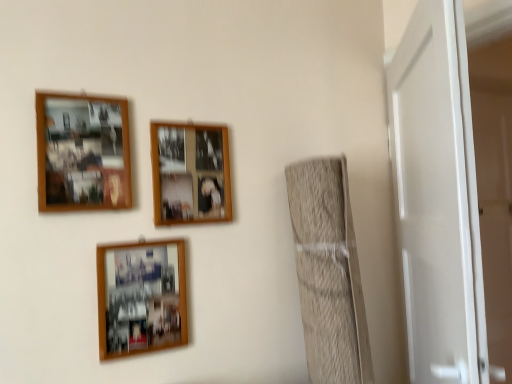
Image resolution: width=512 pixels, height=384 pixels. What do you see at coordinates (437, 198) in the screenshot? I see `white glossy door at right` at bounding box center [437, 198].

Where is `wooden photo frame at upper left, positioned as the 3th picture frame in bottom-to-top order`? wooden photo frame at upper left, positioned as the 3th picture frame in bottom-to-top order is located at coordinates (82, 153).

Measure the distance between point (146, 316) and camera.

Point (146, 316) is 1.24 meters away from camera.

Find the location of a particular element. The image size is (512, 384). woodenobject at upper center, the 2th picture frame in the bottom-to-top sequence is located at coordinates (190, 173).

How different are the orientations of woodenobject at upper center, the 2th picture frame in the bottom-to-top sequence, and white glossy door at right in degrees?

The angular difference between woodenobject at upper center, the 2th picture frame in the bottom-to-top sequence, and white glossy door at right is 52.9 degrees.

Which is behind, point (159, 194) or point (472, 219)?

The point (159, 194) is farther.

Is woodenobject at upper center, arranged as the 2th picture frame when viewed from the top, thinner than white glossy door at right?

Correct, the width of woodenobject at upper center, arranged as the 2th picture frame when viewed from the top, is less than that of white glossy door at right.

Considering the positions of objects woodenobject at upper center, arranged as the 2th picture frame when viewed from the top, and white glossy door at right in the image provided, who is in front, woodenobject at upper center, arranged as the 2th picture frame when viewed from the top, or white glossy door at right?

white glossy door at right is more forward.

Does wooden photo frame at lower center, which appears as the first picture frame when ordered from the bottom, contain wooden photo frame at upper left, acting as the 1th picture frame starting from the top?

No.

Does wooden photo frame at lower center, which appears as the first picture frame when ordered from the bottom, have a greater height compared to wooden photo frame at upper left, acting as the 1th picture frame starting from the top?

Incorrect, the height of wooden photo frame at lower center, which appears as the first picture frame when ordered from the bottom, is not larger of that of wooden photo frame at upper left, acting as the 1th picture frame starting from the top.

Is point (102, 276) closer or farther from the camera than point (128, 153)?

Point (102, 276) is positioned closer to the camera compared to point (128, 153).

Which object is positioned more to the right, woodenobject at upper center, arranged as the 2th picture frame when viewed from the top, or wooden photo frame at upper left, acting as the 1th picture frame starting from the top?

woodenobject at upper center, arranged as the 2th picture frame when viewed from the top, is more to the right.

Between woodenobject at upper center, arranged as the 2th picture frame when viewed from the top, and wooden photo frame at upper left, acting as the 1th picture frame starting from the top, which one has more height?

Standing taller between the two is wooden photo frame at upper left, acting as the 1th picture frame starting from the top.

Choose the correct answer: Is woodenobject at upper center, the 2th picture frame in the bottom-to-top sequence, inside wooden photo frame at upper left, positioned as the 3th picture frame in bottom-to-top order, or outside it?

woodenobject at upper center, the 2th picture frame in the bottom-to-top sequence, is located beyond the bounds of wooden photo frame at upper left, positioned as the 3th picture frame in bottom-to-top order.

Does point (158, 186) appear closer or farther from the camera than point (84, 105)?

Clearly, point (158, 186) is more distant from the camera than point (84, 105).

Could you tell me if woodenobject at upper center, the 2th picture frame in the bottom-to-top sequence, is facing wooden photo frame at lower center, which appears as the first picture frame when ordered from the bottom?

No, woodenobject at upper center, the 2th picture frame in the bottom-to-top sequence, is not oriented towards wooden photo frame at lower center, which appears as the first picture frame when ordered from the bottom.

Which is less distant, (172, 182) or (186, 320)?

Point (172, 182).

Considering the positions of objects woodenobject at upper center, arranged as the 2th picture frame when viewed from the top, and wooden photo frame at lower center, which is the third picture frame in top-to-bottom order, in the image provided, who is more to the left, woodenobject at upper center, arranged as the 2th picture frame when viewed from the top, or wooden photo frame at lower center, which is the third picture frame in top-to-bottom order,?

wooden photo frame at lower center, which is the third picture frame in top-to-bottom order, is more to the left.

Does woodenobject at upper center, arranged as the 2th picture frame when viewed from the top, have a smaller size compared to wooden photo frame at lower center, which is the third picture frame in top-to-bottom order?

Yes.

Is wooden photo frame at lower center, which is the third picture frame in top-to-bottom order, further to camera compared to white glossy door at right?

Yes, wooden photo frame at lower center, which is the third picture frame in top-to-bottom order, is behind white glossy door at right.

From the image's perspective, which object appears higher, wooden photo frame at lower center, which appears as the first picture frame when ordered from the bottom, or white glossy door at right?

white glossy door at right is shown above in the image.

Who is taller, wooden photo frame at lower center, which appears as the first picture frame when ordered from the bottom, or white glossy door at right?

With more height is white glossy door at right.

Does white glossy door at right have a lesser height compared to wooden photo frame at upper left, positioned as the 3th picture frame in bottom-to-top order?

No.

Looking at this image, from a real-world perspective, between white glossy door at right and wooden photo frame at upper left, positioned as the 3th picture frame in bottom-to-top order, who is vertically higher?

wooden photo frame at upper left, positioned as the 3th picture frame in bottom-to-top order, is physically above.

Can you confirm if white glossy door at right is smaller than wooden photo frame at upper left, positioned as the 3th picture frame in bottom-to-top order?

Actually, white glossy door at right might be larger than wooden photo frame at upper left, positioned as the 3th picture frame in bottom-to-top order.

Could you tell me if white glossy door at right is turned towards wooden photo frame at upper left, positioned as the 3th picture frame in bottom-to-top order?

No, white glossy door at right is not oriented towards wooden photo frame at upper left, positioned as the 3th picture frame in bottom-to-top order.

In the scene shown: From a real-world perspective, does wooden photo frame at upper left, positioned as the 3th picture frame in bottom-to-top order, stand above white glossy door at right?

Yes, from a real-world perspective, wooden photo frame at upper left, positioned as the 3th picture frame in bottom-to-top order, is over white glossy door at right

Relative to white glossy door at right, is wooden photo frame at upper left, acting as the 1th picture frame starting from the top, in front or behind?

In the image, wooden photo frame at upper left, acting as the 1th picture frame starting from the top, appears behind white glossy door at right.

From the image's perspective, which is below, wooden photo frame at upper left, acting as the 1th picture frame starting from the top, or white glossy door at right?

white glossy door at right.

Which of these two, wooden photo frame at upper left, positioned as the 3th picture frame in bottom-to-top order, or white glossy door at right, stands shorter?

wooden photo frame at upper left, positioned as the 3th picture frame in bottom-to-top order, is shorter.

The image size is (512, 384). There is a white glossy door at right. Identify the location of the 1st picture frame above it (from a real-world perspective). (190, 173).

From the image's perspective, which picture frame is the 2nd one above the wooden photo frame at lower center, which is the third picture frame in top-to-bottom order? Please provide its 2D coordinates.

[(82, 153)]

Based on the photo, looking at the image, which one is located further to white glossy door at right, woodenobject at upper center, the 2th picture frame in the bottom-to-top sequence, or wooden photo frame at lower center, which appears as the first picture frame when ordered from the bottom?

The object further to white glossy door at right is wooden photo frame at lower center, which appears as the first picture frame when ordered from the bottom.

Considering their positions, is wooden photo frame at lower center, which is the third picture frame in top-to-bottom order, positioned further to white glossy door at right than wooden photo frame at upper left, acting as the 1th picture frame starting from the top?

wooden photo frame at upper left, acting as the 1th picture frame starting from the top, is further to white glossy door at right.

From the image, which object appears to be nearer to wooden photo frame at upper left, positioned as the 3th picture frame in bottom-to-top order, wooden photo frame at lower center, which is the third picture frame in top-to-bottom order, or woodenobject at upper center, the 2th picture frame in the bottom-to-top sequence?

The object closer to wooden photo frame at upper left, positioned as the 3th picture frame in bottom-to-top order, is woodenobject at upper center, the 2th picture frame in the bottom-to-top sequence.

Which object lies nearer to the anchor point woodenobject at upper center, arranged as the 2th picture frame when viewed from the top, wooden photo frame at upper left, positioned as the 3th picture frame in bottom-to-top order, or wooden photo frame at lower center, which appears as the first picture frame when ordered from the bottom?

wooden photo frame at upper left, positioned as the 3th picture frame in bottom-to-top order, is closer to woodenobject at upper center, arranged as the 2th picture frame when viewed from the top.

Looking at the image, which one is located further to woodenobject at upper center, the 2th picture frame in the bottom-to-top sequence, wooden photo frame at lower center, which is the third picture frame in top-to-bottom order, or wooden photo frame at upper left, positioned as the 3th picture frame in bottom-to-top order?

Among the two, wooden photo frame at lower center, which is the third picture frame in top-to-bottom order, is located further to woodenobject at upper center, the 2th picture frame in the bottom-to-top sequence.

Considering their positions, is white glossy door at right positioned closer to woodenobject at upper center, arranged as the 2th picture frame when viewed from the top, than wooden photo frame at lower center, which is the third picture frame in top-to-bottom order?

wooden photo frame at lower center, which is the third picture frame in top-to-bottom order, lies closer to woodenobject at upper center, arranged as the 2th picture frame when viewed from the top, than the other object.

Estimate the real-world distances between objects in this image. Which object is further from wooden photo frame at lower center, which appears as the first picture frame when ordered from the bottom, woodenobject at upper center, arranged as the 2th picture frame when viewed from the top, or white glossy door at right?

white glossy door at right.

Estimate the real-world distances between objects in this image. Which object is closer to wooden photo frame at upper left, positioned as the 3th picture frame in bottom-to-top order, white glossy door at right or woodenobject at upper center, the 2th picture frame in the bottom-to-top sequence?

woodenobject at upper center, the 2th picture frame in the bottom-to-top sequence, is closer to wooden photo frame at upper left, positioned as the 3th picture frame in bottom-to-top order.

Identify the location of picture frame between wooden photo frame at upper left, positioned as the 3th picture frame in bottom-to-top order, and wooden photo frame at lower center, which is the third picture frame in top-to-bottom order, in the up-down direction. (190, 173).

Image resolution: width=512 pixels, height=384 pixels. I want to click on picture frame located between wooden photo frame at lower center, which is the third picture frame in top-to-bottom order, and white glossy door at right in the left-right direction, so click(190, 173).